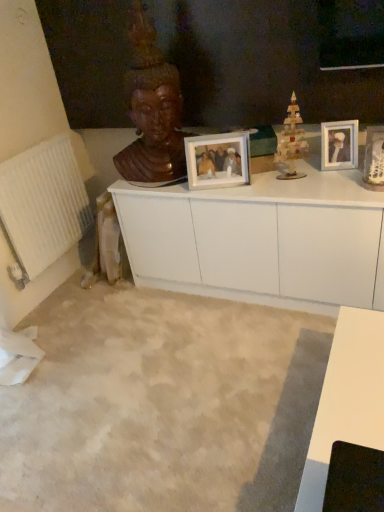
Where is `free spot below white textured radiator at left (from a real-world perspective)`? The image size is (384, 512). free spot below white textured radiator at left (from a real-world perspective) is located at coordinates (64, 285).